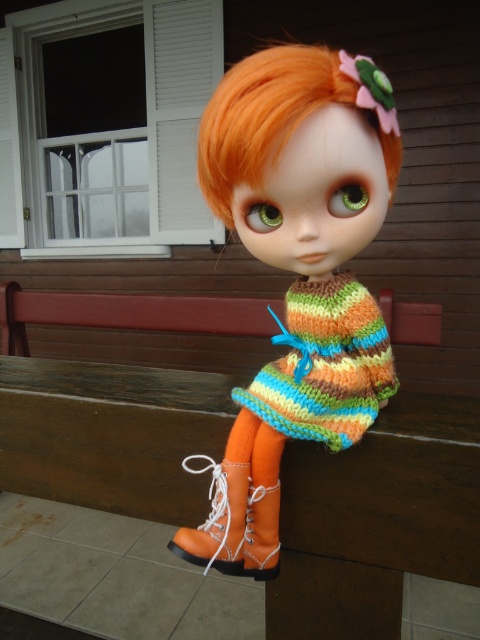
You are standing in front of the doll on the wooden bench. There are two points marked on the doll, one at coordinates point (220, 180) and another at point (228, 184). Which point is closer to you?

Point (220, 180) is closer to the camera than point (228, 184).

You are a tailor who wants to create a replica of the doll in the image. You have the exact measurements of the orange leather boot at lower center. Do you need to adjust the size of the knitted multicolor sweater at center to ensure it fits properly?

The knitted multicolor sweater at center is taller than the orange leather boot at lower center, so you need to make the sweater larger than the boot to match the doll in the image.

You are a photographer setting up a shot of the doll. You want to ensure the brown wooden bench at center and the orange leather boot at lower center are both in frame. Based on their positions, which object should you adjust to be closer to the right side of the frame?

The brown wooden bench at center is positioned on the left side of orange leather boot at lower center, so you should adjust the brown wooden bench at center to move it closer to the right side of the frame.